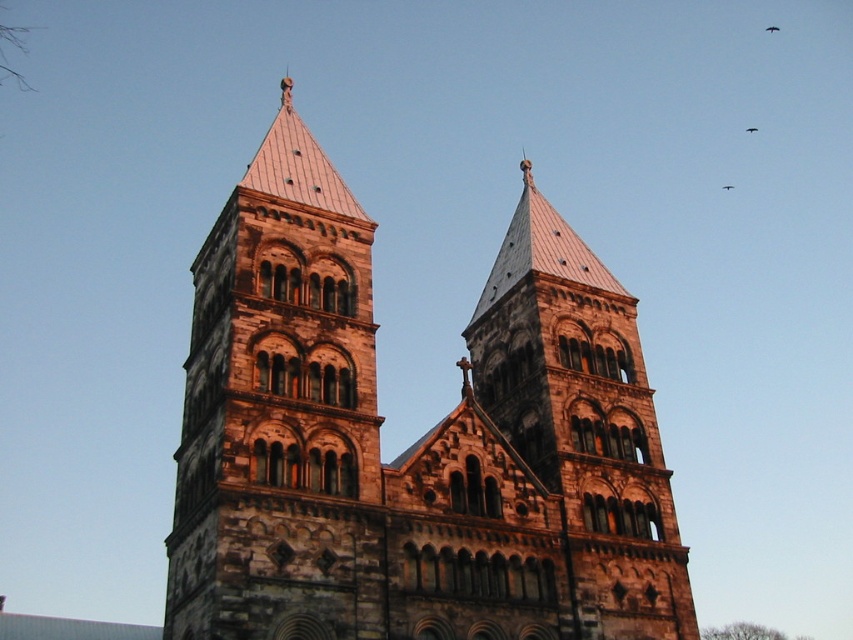
The height and width of the screenshot is (640, 853). What do you see at coordinates (281, 412) in the screenshot? I see `brown stone tower at left` at bounding box center [281, 412].

Consider the image. Who is lower down, brown stone tower at left or rustic stone tower at center?

rustic stone tower at center is lower down.

Is point (209, 598) positioned in front of point (642, 577)?

Yes, it is in front of point (642, 577).

You are a GUI agent. You are given a task and a screenshot of the screen. Output one action in this format:
    pyautogui.click(x=<x>, y=<y>)
    Task: Click on the brown stone tower at left
    
    Given the screenshot: What is the action you would take?
    pyautogui.click(x=281, y=412)

Is brown stone church at center below black feathered bird at upper center?

Correct, brown stone church at center is located below black feathered bird at upper center.

Does brown stone church at center have a larger size compared to black feathered bird at upper center?

Yes, brown stone church at center is bigger than black feathered bird at upper center.

Between point (347, 404) and point (747, 131), which one is positioned in front?

Point (347, 404)

You are a GUI agent. You are given a task and a screenshot of the screen. Output one action in this format:
    pyautogui.click(x=<x>, y=<y>)
    Task: Click on the brown stone church at center
    
    Given the screenshot: What is the action you would take?
    pyautogui.click(x=413, y=442)

Does brown stone church at center have a greater height compared to rustic stone tower at center?

Yes.

Between brown stone church at center and rustic stone tower at center, which one is positioned higher?

rustic stone tower at center

Is point (550, 250) more distant than point (468, 364)?

Yes, point (550, 250) is behind point (468, 364).

Locate an element on the screen. This screenshot has height=640, width=853. brown stone church at center is located at coordinates (413, 442).